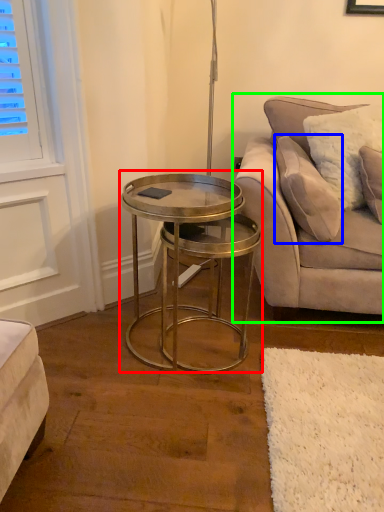
Question: Which object is the farthest from coffee table (highlighted by a red box)? Choose among these: pillow (highlighted by a blue box) or studio couch (highlighted by a green box).

Choices:
 (A) pillow
 (B) studio couch

Answer: (A)